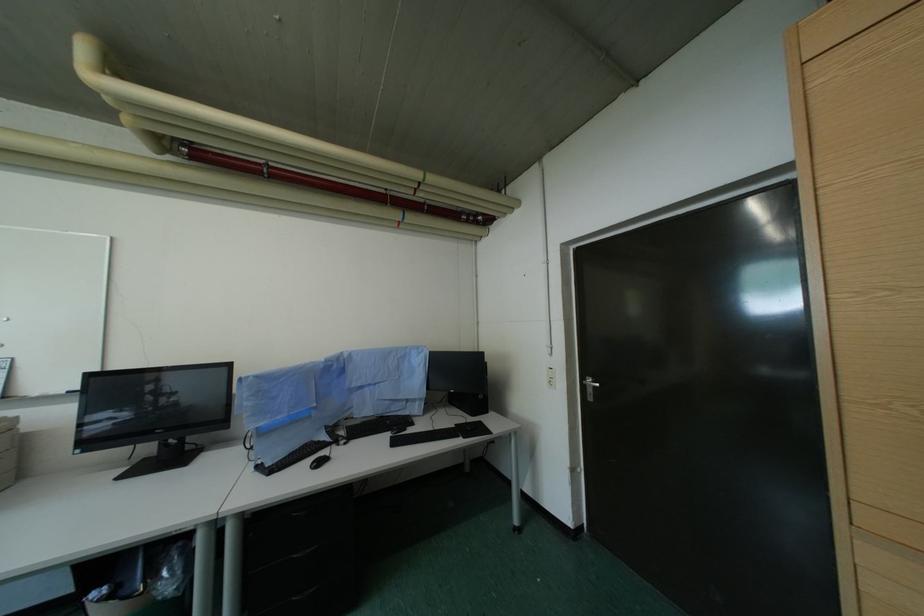
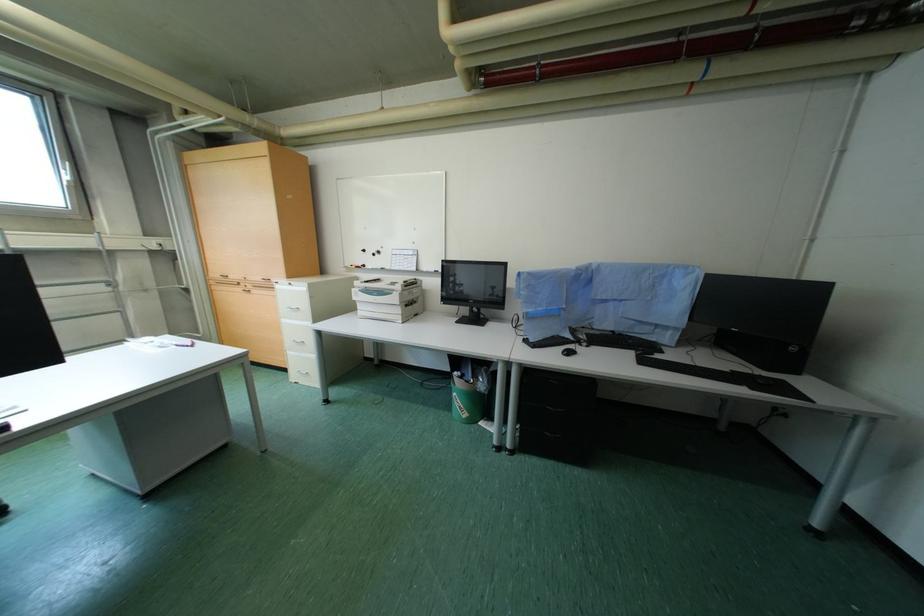
Based on the continuous images, in which direction is the camera rotating?

The camera's rotation is toward left-down.